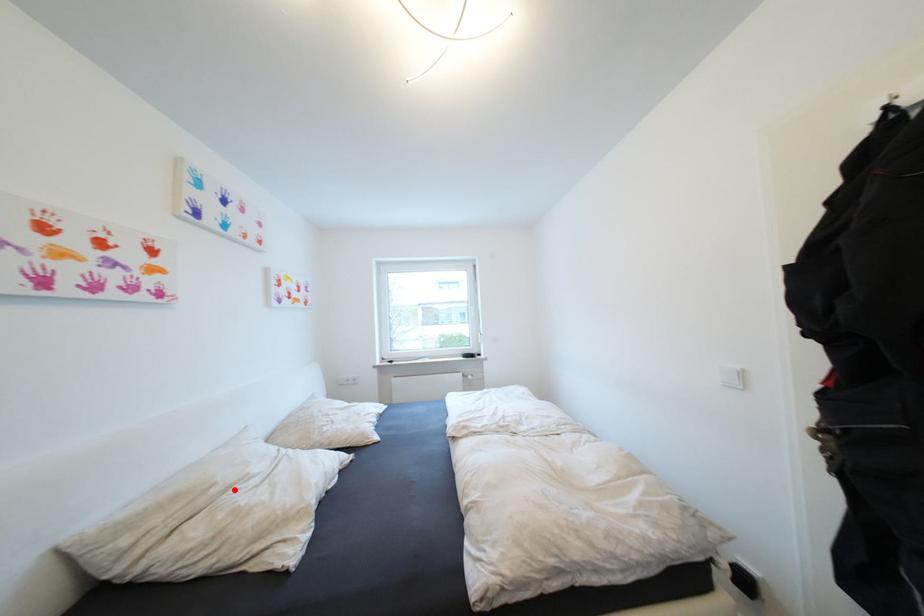
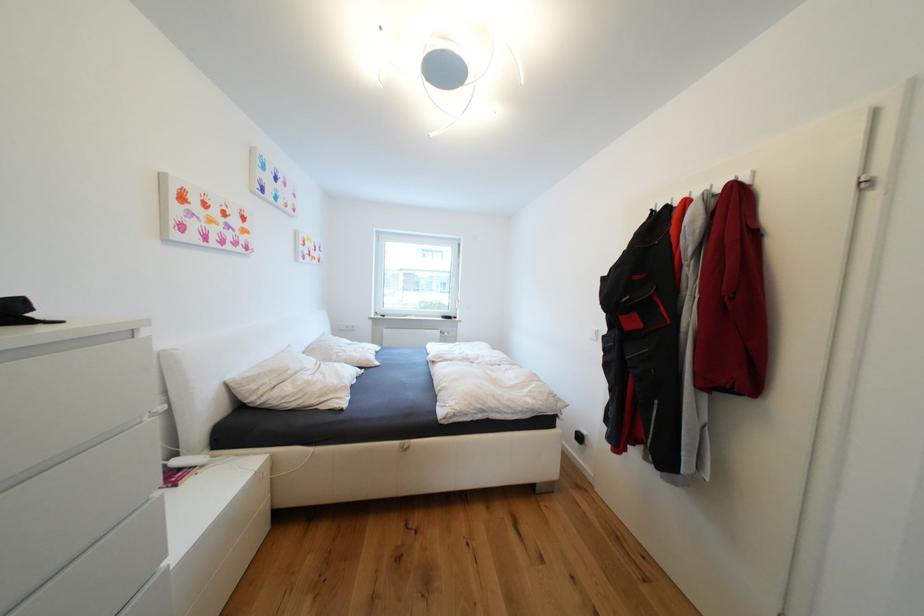
Find the pixel in the second image that matches the highlighted location in the first image.

(304, 374)